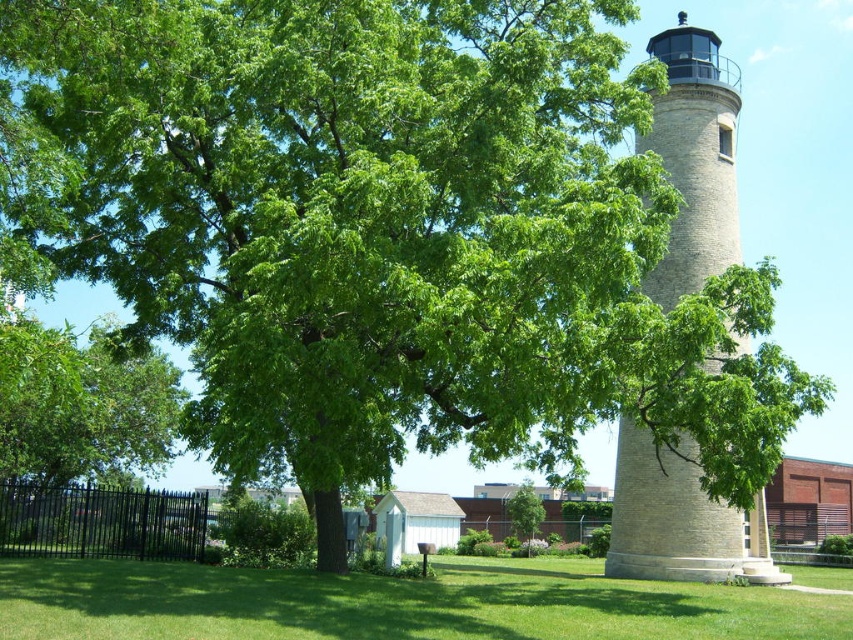
Does point (532, 564) come behind point (534, 509)?

No.

Describe the element at coordinates (395, 604) in the screenshot. Image resolution: width=853 pixels, height=640 pixels. I see `green grass at lower center` at that location.

I want to click on green grass at lower center, so click(395, 604).

Is green leafy tree at left further to camera compared to green leafy tree at center?

No.

Who is more distant from viewer, (73, 381) or (525, 524)?

Positioned behind is point (525, 524).

You are a GUI agent. You are given a task and a screenshot of the screen. Output one action in this format:
    pyautogui.click(x=<x>, y=<y>)
    Task: Click on the green leafy tree at left
    
    Given the screenshot: What is the action you would take?
    pyautogui.click(x=74, y=420)

Which of these two, beige stone lighthouse at right or green leafy tree at left, stands taller?

beige stone lighthouse at right

What do you see at coordinates (695, 160) in the screenshot? I see `beige stone lighthouse at right` at bounding box center [695, 160].

Between point (654, 273) and point (32, 429), which one is positioned in front?

Point (654, 273)

Where is `beige stone lighthouse at right`? The width and height of the screenshot is (853, 640). beige stone lighthouse at right is located at coordinates (695, 160).